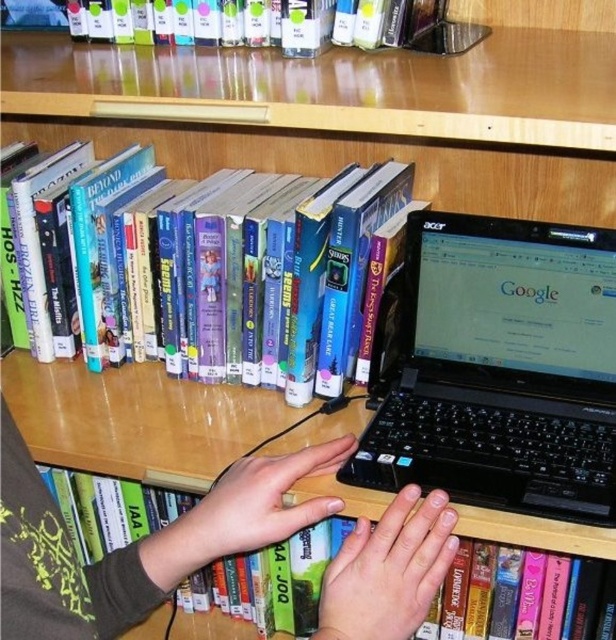
Does black plastic laptop at center have a lesser width compared to hardcover book at upper center?

Indeed, black plastic laptop at center has a lesser width compared to hardcover book at upper center.

Does black plastic laptop at center have a greater height compared to hardcover book at upper center?

Correct, black plastic laptop at center is much taller as hardcover book at upper center.

This screenshot has height=640, width=616. What do you see at coordinates (501, 369) in the screenshot?
I see `black plastic laptop at center` at bounding box center [501, 369].

This screenshot has height=640, width=616. Identify the location of black plastic laptop at center. (501, 369).

Which is in front, point (468, 280) or point (246, 472)?

Positioned in front is point (246, 472).

In the scene shown: Who is shorter, black plastic laptop at center or green matte hands at center?

green matte hands at center is shorter.

Describe the element at coordinates (501, 369) in the screenshot. I see `black plastic laptop at center` at that location.

Where is `black plastic laptop at center`? This screenshot has width=616, height=640. black plastic laptop at center is located at coordinates (501, 369).

Is light skin hand at center above hardcover book at upper center?

Actually, light skin hand at center is below hardcover book at upper center.

Who is higher up, light skin hand at center or hardcover book at upper center?

hardcover book at upper center is above.

The image size is (616, 640). In order to click on light skin hand at center in this screenshot , I will do `click(259, 502)`.